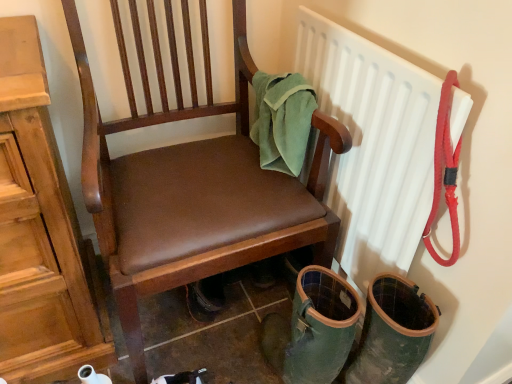
Question: Is white plastic radiator at upper right wider than brown leather chair at center?

Choices:
 (A) yes
 (B) no

Answer: (B)

Question: Is white plastic radiator at upper right smaller than brown leather chair at center?

Choices:
 (A) yes
 (B) no

Answer: (A)

Question: Is white plastic radiator at upper right shorter than brown leather chair at center?

Choices:
 (A) no
 (B) yes

Answer: (B)

Question: Does white plastic radiator at upper right appear on the left side of brown leather chair at center?

Choices:
 (A) yes
 (B) no

Answer: (B)

Question: Could you tell me if white plastic radiator at upper right is turned towards brown leather chair at center?

Choices:
 (A) no
 (B) yes

Answer: (B)

Question: Is white plastic radiator at upper right facing away from brown leather chair at center?

Choices:
 (A) yes
 (B) no

Answer: (A)

Question: Does green felt towel at upper right lie behind white plastic radiator at upper right?

Choices:
 (A) no
 (B) yes

Answer: (B)

Question: Considering the relative positions of green felt towel at upper right and white plastic radiator at upper right in the image provided, is green felt towel at upper right to the left of white plastic radiator at upper right from the viewer's perspective?

Choices:
 (A) yes
 (B) no

Answer: (A)

Question: From a real-world perspective, is green felt towel at upper right positioned under white plastic radiator at upper right based on gravity?

Choices:
 (A) no
 (B) yes

Answer: (A)

Question: From a real-world perspective, is green felt towel at upper right physically above white plastic radiator at upper right?

Choices:
 (A) yes
 (B) no

Answer: (A)

Question: Is green felt towel at upper right located outside white plastic radiator at upper right?

Choices:
 (A) no
 (B) yes

Answer: (B)

Question: From the image's perspective, is green felt towel at upper right beneath white plastic radiator at upper right?

Choices:
 (A) no
 (B) yes

Answer: (A)

Question: From the image's perspective, is brown leather chair at center over green felt towel at upper right?

Choices:
 (A) no
 (B) yes

Answer: (A)